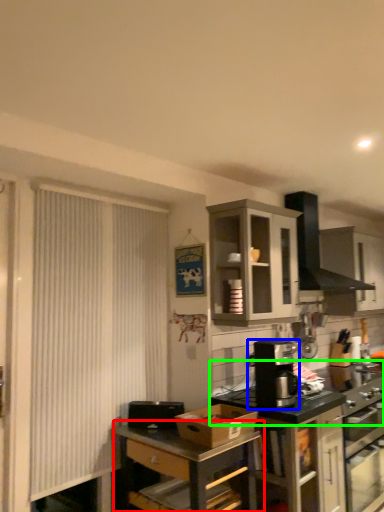
Question: Based on their relative distances, which object is farther from table (highlighted by a red box)? Choose from kitchen appliance (highlighted by a blue box) and countertop (highlighted by a green box).

Choices:
 (A) kitchen appliance
 (B) countertop

Answer: (B)